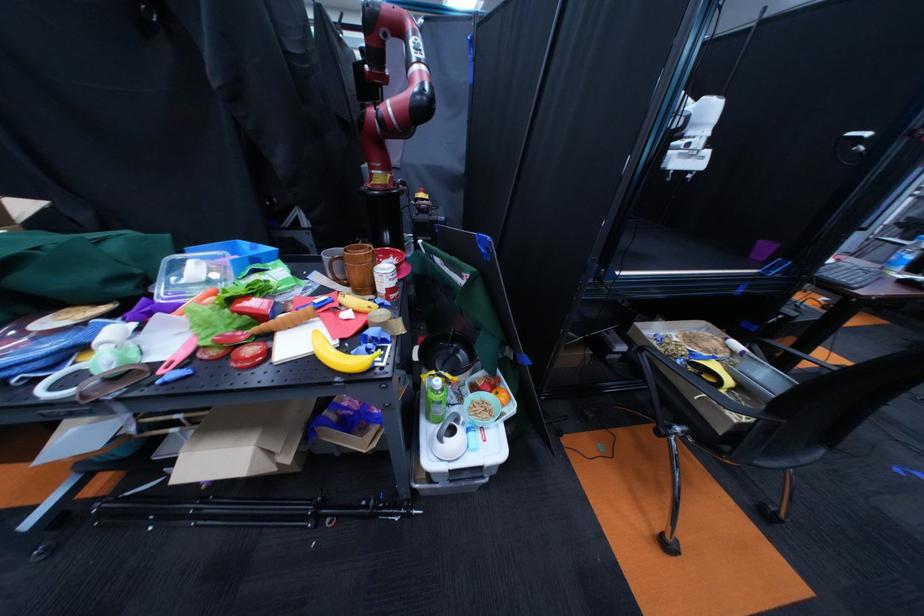
Identify the location of brown mug handle. (357, 268).